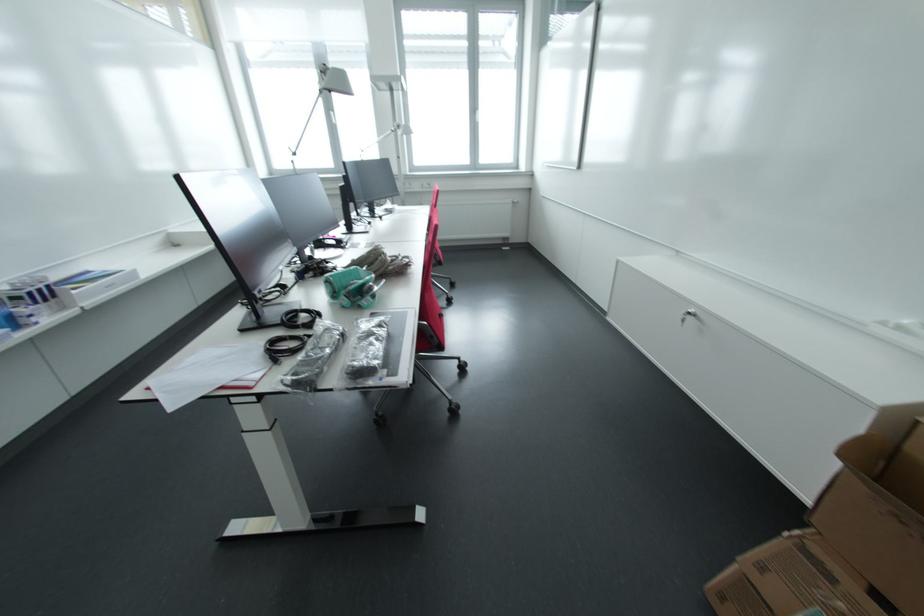
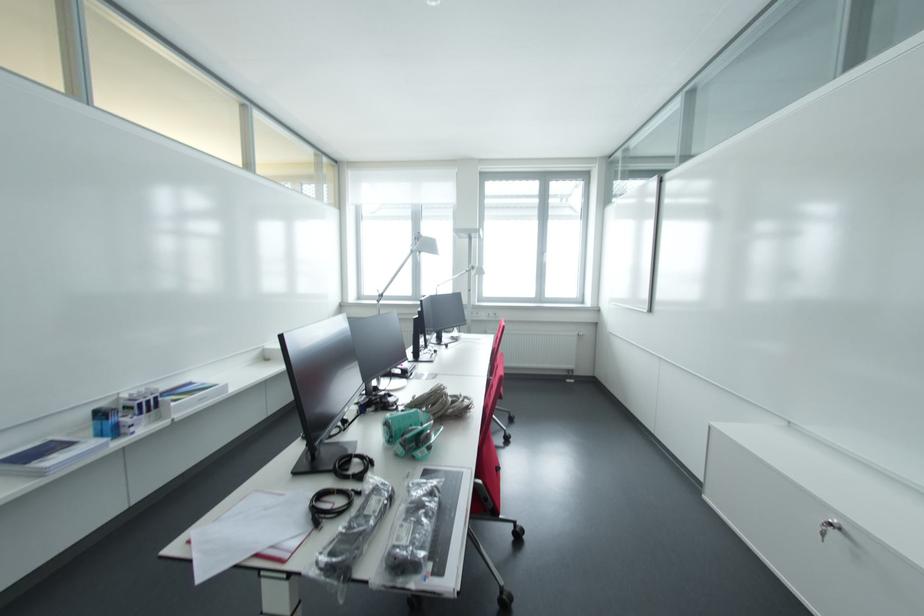
Locate, in the second image, the point that corresponds to pixel 377 329 in the first image.

(428, 496)